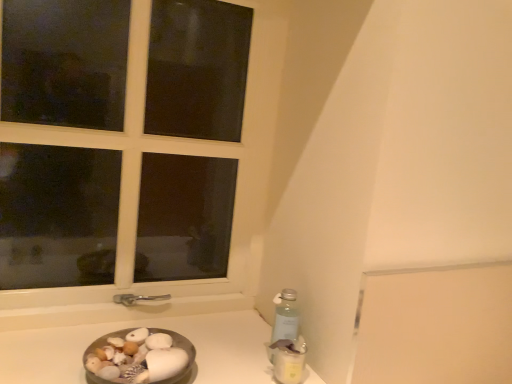
You are a GUI agent. You are given a task and a screenshot of the screen. Output one action in this format:
    pyautogui.click(x=<x>, y=<y>)
    Task: Click on the vacant space to the right of smooth white shells at lower left
    
    Given the screenshot: What is the action you would take?
    pyautogui.click(x=232, y=364)